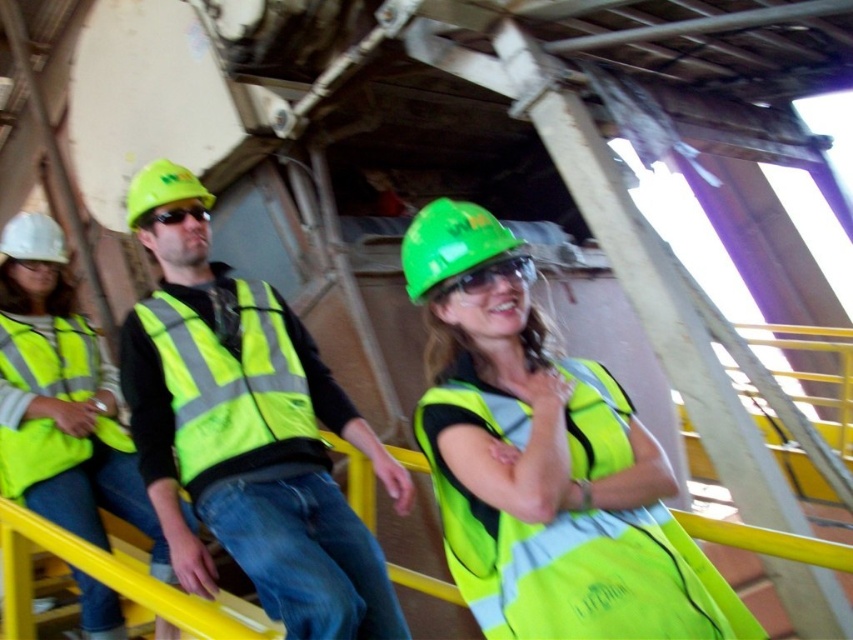
At what (x,y) coordinates should I click in order to perform the action: click on neon green reflective vest at center. Please return your answer as a coordinate pair (x, y). This screenshot has width=853, height=640. Looking at the image, I should click on tap(540, 461).

Between point (665, 611) and point (79, 413), which one is positioned behind?

The point (79, 413) is more distant.

Is point (637, 627) more distant than point (15, 454)?

No, it is in front of (15, 454).

Locate an element on the screen. Image resolution: width=853 pixels, height=640 pixels. neon green reflective vest at center is located at coordinates (540, 461).

Is neon yellow reflective vest at center smaller than green matte safety helmet at center?

Actually, neon yellow reflective vest at center might be larger than green matte safety helmet at center.

Does point (32, 252) lie behind point (434, 256)?

That is True.

At what (x,y) coordinates should I click in order to perform the action: click on neon yellow reflective vest at center. Please return your answer as a coordinate pair (x, y). This screenshot has width=853, height=640. Looking at the image, I should click on (61, 400).

Can you confirm if green matte safety helmet at center is positioned below matte green goggles at center?

Correct, green matte safety helmet at center is located below matte green goggles at center.

Can you confirm if green matte safety helmet at center is bigger than matte green goggles at center?

Yes, green matte safety helmet at center is bigger than matte green goggles at center.

Is point (410, 285) closer to viewer compared to point (144, 227)?

Yes, it is.

I want to click on green matte safety helmet at center, so click(x=450, y=243).